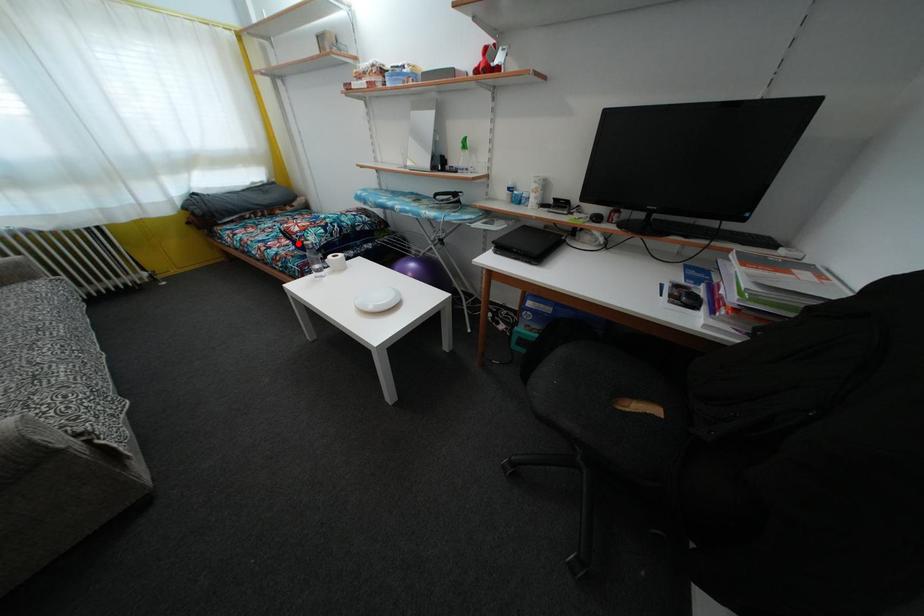
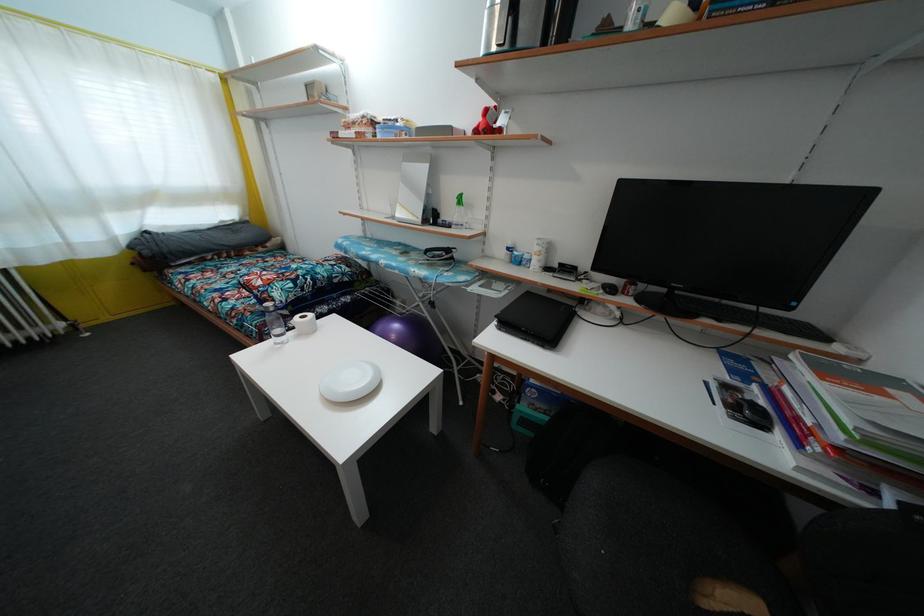
The point at the highlighted location is marked in the first image. Where is the corresponding point in the second image?

(259, 299)